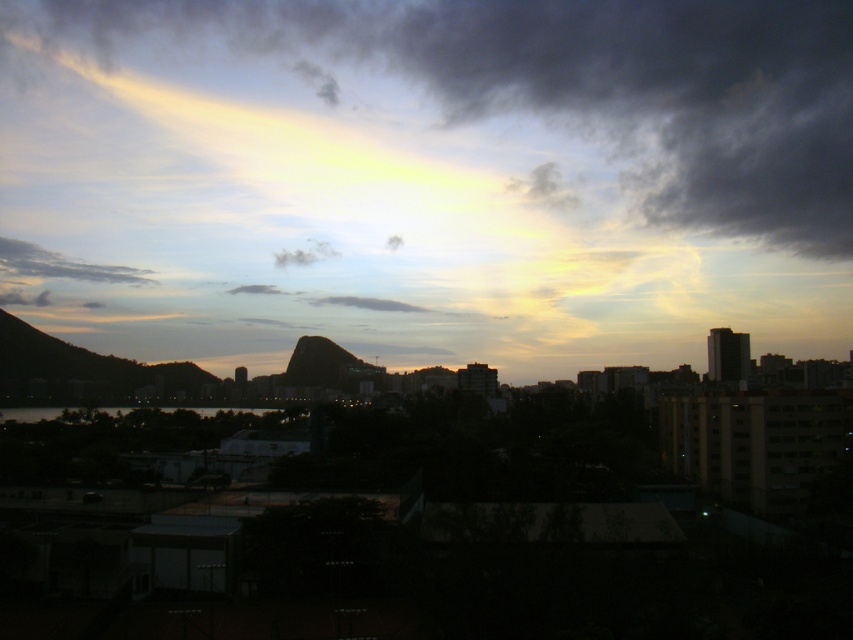
You are an airplane pilot approaching the city. You see the gray cotton cloud at upper left and the white fluffy cloud at center. Which cloud is closer to your plane?

The gray cotton cloud at upper left is closer to your plane because it is positioned further to the viewer than the white fluffy cloud at center.

You are a photographer standing at the camera position in the cityscape image. You want to capture a closeup shot of the white fluffy cloud at center. Given that your telephoto lens can focus on objects up to 400 meters away, will you be able to take a clear photo of the cloud?

The white fluffy cloud at center is 396.29 meters from the camera, which is within the 400 meters range of the telephoto lens. Therefore, you can take a clear photo of the white fluffy cloud at center.